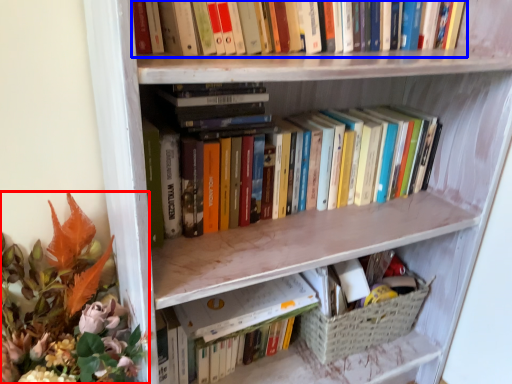
Question: Among these objects, which one is farthest to the camera, floral arrangement (highlighted by a red box) or book (highlighted by a blue box)?

Choices:
 (A) floral arrangement
 (B) book

Answer: (B)